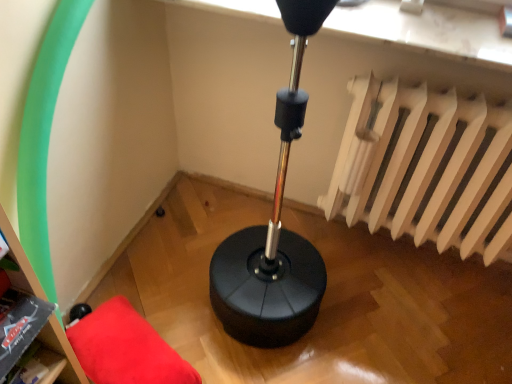
You are a GUI agent. You are given a task and a screenshot of the screen. Output one action in this format:
    pyautogui.click(x=<x>, y=<y>)
    Task: Click on the blank space situated above red fabric cushion at lower left (from a real-world perspective)
    The height and width of the screenshot is (384, 512).
    Given the screenshot: What is the action you would take?
    pyautogui.click(x=123, y=342)